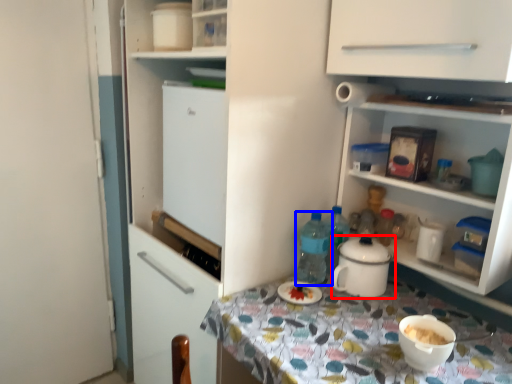
Question: Which object appears closest to the camera in this image, kitchen appliance (highlighted by a red box) or bottle (highlighted by a blue box)?

Choices:
 (A) kitchen appliance
 (B) bottle

Answer: (A)